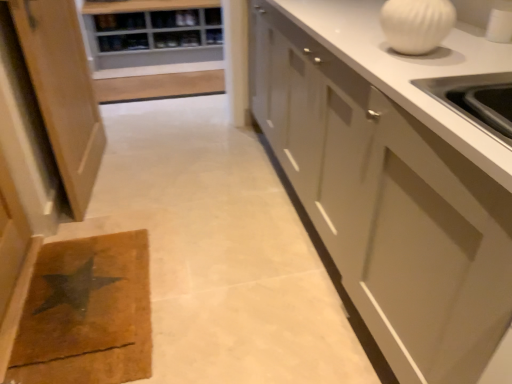
Question: Is wooden shelf at upper center outside of white glossy vase at upper right?

Choices:
 (A) yes
 (B) no

Answer: (A)

Question: Is white glossy vase at upper right inside wooden shelf at upper center?

Choices:
 (A) no
 (B) yes

Answer: (A)

Question: Considering the relative sizes of wooden shelf at upper center and white glossy vase at upper right in the image provided, is wooden shelf at upper center shorter than white glossy vase at upper right?

Choices:
 (A) no
 (B) yes

Answer: (B)

Question: From a real-world perspective, is wooden shelf at upper center below white glossy vase at upper right?

Choices:
 (A) no
 (B) yes

Answer: (B)

Question: Considering the relative sizes of wooden shelf at upper center and white glossy vase at upper right in the image provided, is wooden shelf at upper center smaller than white glossy vase at upper right?

Choices:
 (A) yes
 (B) no

Answer: (A)

Question: Is white glossy vase at upper right to the left or to the right of white glossy cabinet at right, which appears as the 1th cabinetry when viewed from the right, in the image?

Choices:
 (A) left
 (B) right

Answer: (A)

Question: From their relative heights in the image, would you say white glossy vase at upper right is taller or shorter than white glossy cabinet at right, which appears as the 1th cabinetry when viewed from the right?

Choices:
 (A) tall
 (B) short

Answer: (B)

Question: Looking at their shapes, would you say white glossy vase at upper right is wider or thinner than white glossy cabinet at right, which appears as the 1th cabinetry when viewed from the right?

Choices:
 (A) wide
 (B) thin

Answer: (B)

Question: From the image's perspective, is white glossy vase at upper right located above or below white glossy cabinet at right, which is the second cabinetry in left-to-right order?

Choices:
 (A) below
 (B) above

Answer: (B)

Question: From a real-world perspective, relative to white glossy cabinet at right, which is the second cabinetry in left-to-right order, is brown/cork doormat at lower left vertically above or below?

Choices:
 (A) above
 (B) below

Answer: (B)

Question: In the image, is brown/cork doormat at lower left positioned in front of or behind white glossy cabinet at right, which is the second cabinetry in left-to-right order?

Choices:
 (A) behind
 (B) front

Answer: (A)

Question: Considering the relative positions of brown/cork doormat at lower left and white glossy cabinet at right, which appears as the 1th cabinetry when viewed from the right, in the image provided, is brown/cork doormat at lower left to the left or to the right of white glossy cabinet at right, which appears as the 1th cabinetry when viewed from the right,?

Choices:
 (A) left
 (B) right

Answer: (A)

Question: Which is correct: brown/cork doormat at lower left is inside white glossy cabinet at right, which is the second cabinetry in left-to-right order, or outside of it?

Choices:
 (A) outside
 (B) inside

Answer: (A)

Question: Is white glossy vase at upper right in front of or behind wooden shelf at upper center in the image?

Choices:
 (A) front
 (B) behind

Answer: (A)

Question: Is point (429, 11) positioned closer to the camera than point (210, 36)?

Choices:
 (A) farther
 (B) closer

Answer: (B)